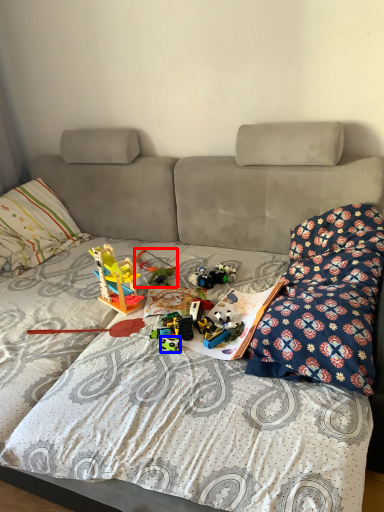
Question: Which object appears farthest to the camera in this image, toy (highlighted by a red box) or toy (highlighted by a blue box)?

Choices:
 (A) toy
 (B) toy

Answer: (A)